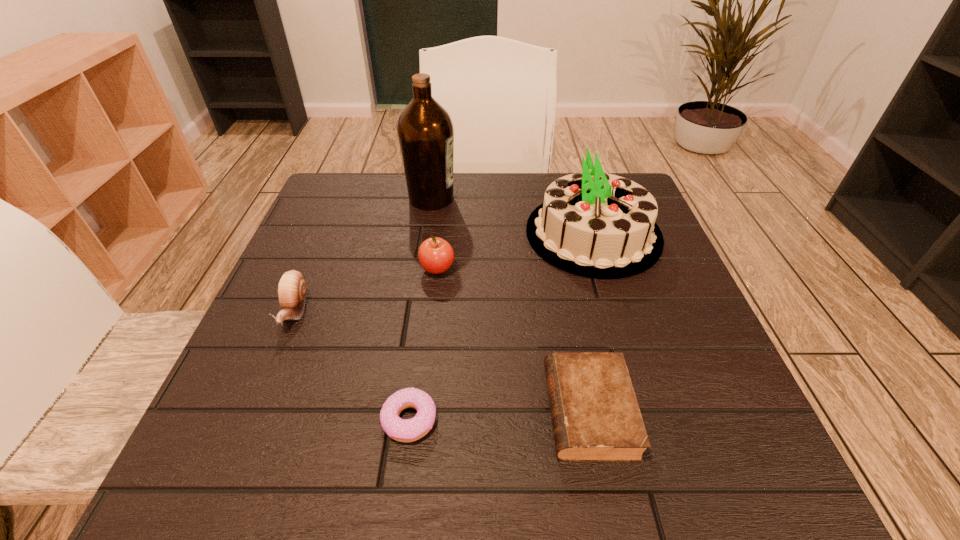
Locate an element on the screen. This screenshot has height=540, width=960. object positioned at the right edge is located at coordinates coord(596,225).

This screenshot has width=960, height=540. I want to click on object that is at the far right corner, so click(x=596, y=225).

The image size is (960, 540). I want to click on free region at the far edge of the desktop, so click(x=464, y=226).

Find the location of a particular element. This screenshot has height=540, width=960. vacant space at the near edge of the desktop is located at coordinates (343, 491).

The width and height of the screenshot is (960, 540). In the image, there is a desktop. Identify the location of vacant space at the left edge. (213, 410).

The height and width of the screenshot is (540, 960). Find the location of `vacant space at the far left corner of the desktop`. vacant space at the far left corner of the desktop is located at coordinates (368, 185).

Where is `vacant space in between the shortest object and the olive oil`? vacant space in between the shortest object and the olive oil is located at coordinates (420, 309).

This screenshot has width=960, height=540. What are the coordinates of `vacant point located between the birthday cake and the apple` in the screenshot? It's located at (516, 252).

You are a GUI agent. You are given a task and a screenshot of the screen. Output one action in this format:
    pyautogui.click(x=<x>, y=<y>)
    Task: Click on the free point between the apple and the second tallest object
    This screenshot has height=540, width=960.
    Given the screenshot: What is the action you would take?
    pyautogui.click(x=516, y=252)

Find the location of a particular element. The height and width of the screenshot is (540, 960). vacant area between the apple and the tallest object is located at coordinates (434, 234).